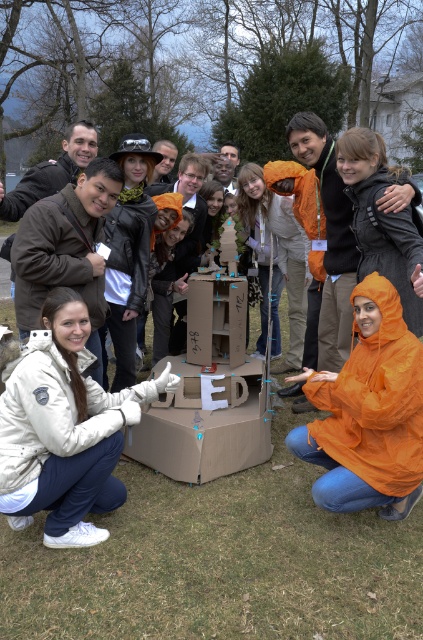
What is located at the coordinate point (63,428) in the image?

The white fleece jacket at lower left is located at point (63,428).

You are a delivery person who needs to place a small package between the orange waterproof jacket at lower center and the cardboard box at center. Can you fit the package there if it measures 80 centimeters in length?

The distance between the orange waterproof jacket at lower center and the cardboard box at center is 79.49 centimeters, so the package measuring 80 centimeters is slightly too long to fit in the space between them.

You are a photographer standing in the park and want to take a photo of the cardboard box at center without the white fleece jacket at lower left appearing in the frame. Is the jacket currently positioned in a way that would block your view of the box?

The white fleece jacket at lower left is located above the cardboard box at center, so it might block the view depending on the angle. To avoid the jacket, you could lower your camera angle or move to the side to ensure the box is visible without obstruction.